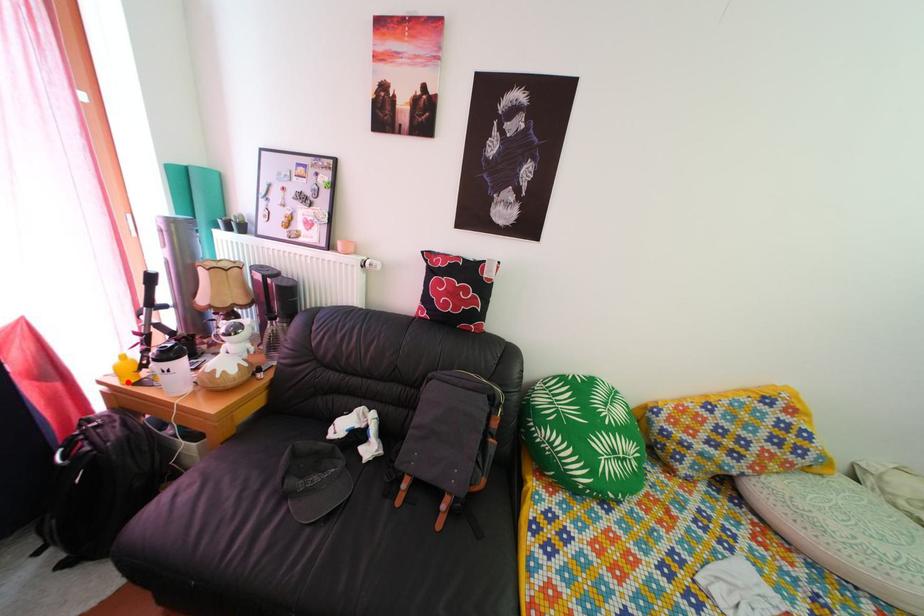
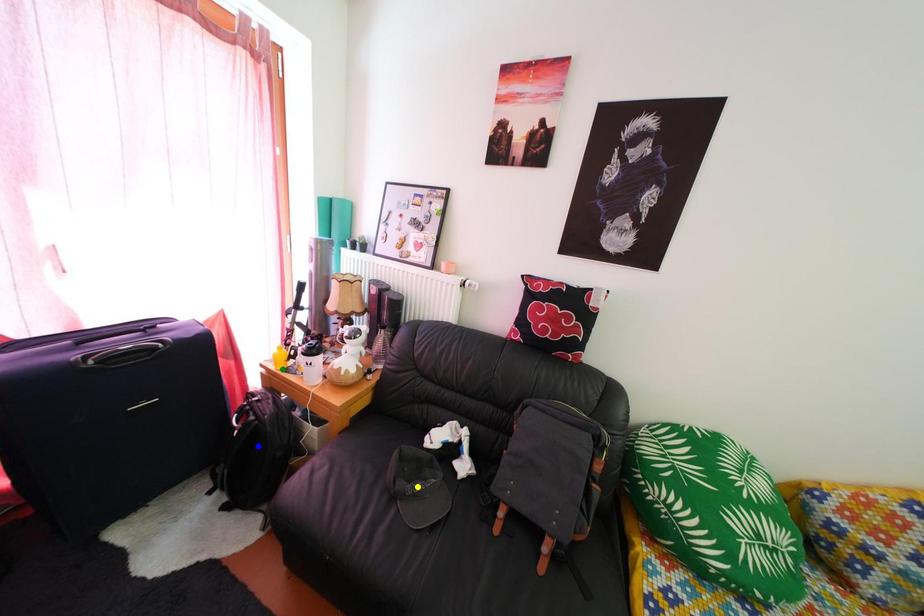
Question: I am providing you with two images of the same scene from different viewpoints. A red point is marked on the first image. You are given multiple points on the second image. Which mark in image 2 goes with the point in image 1?

Choices:
 (A) yellow point
 (B) blue point
 (C) green point

Answer: (C)